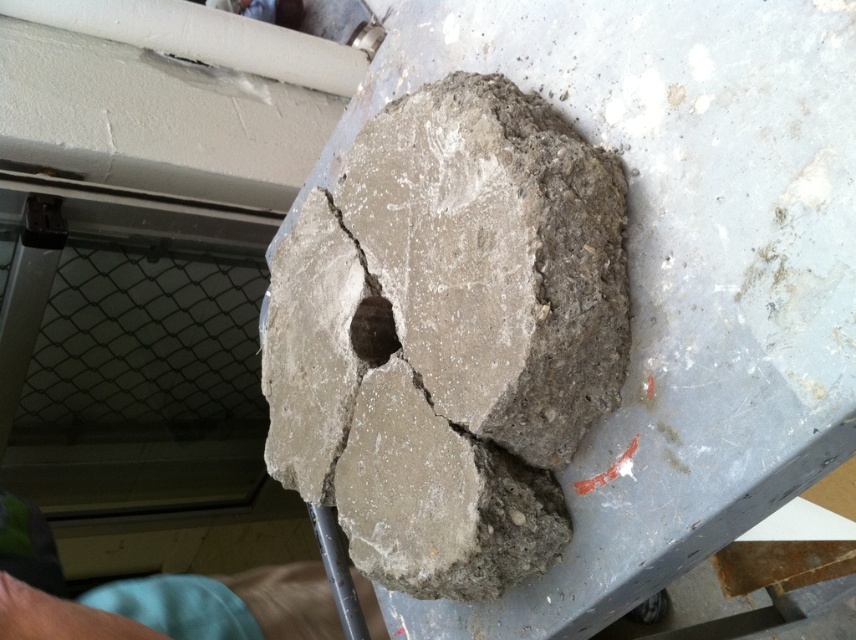
You are an artist holding the gray concrete at center and the skinny blue shorts at lower left. To place them correctly on your canvas, which object should you paint first if you follow the rule of starting from the leftmost item?

The skinny blue shorts at lower left should be painted first because it is positioned to the left of the gray concrete at center.

You are a geologist examining the gray concrete at center. You need to locate a specific point marked at coordinates point (673, 272). Where exactly is this point located in relation to the gray concrete at center?

The point (673, 272) marks the exact location of the gray concrete at center.